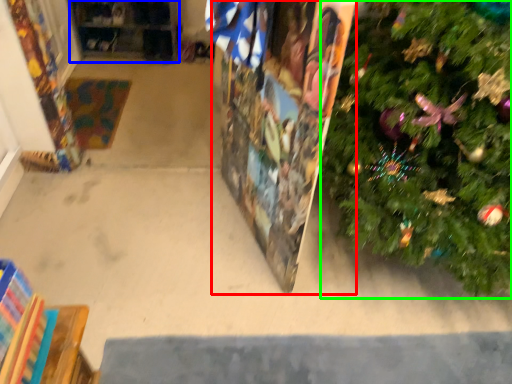
Question: Which object is the closest to the bulletin board (highlighted by a red box)? Choose among these: shelf (highlighted by a blue box) or christmas tree (highlighted by a green box).

Choices:
 (A) shelf
 (B) christmas tree

Answer: (B)